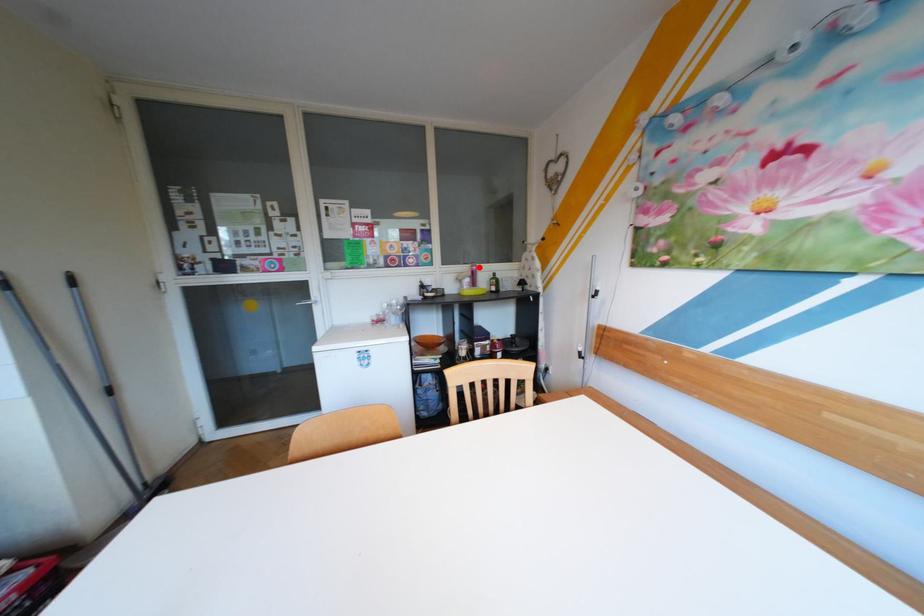
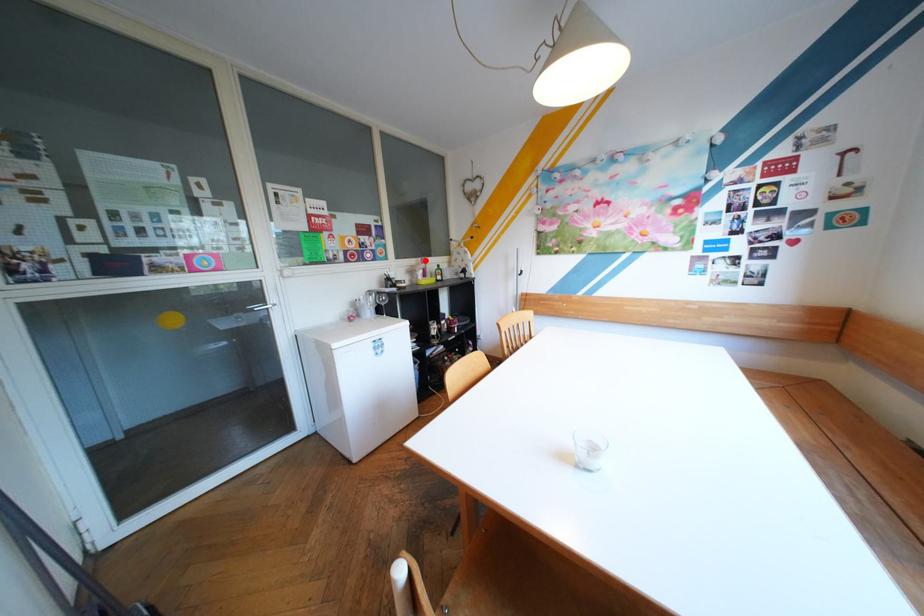
I am providing you with two images of the same scene from different viewpoints. A red point is marked on the first image and another point is marked on the second image. Does the point marked in image1 correspond to the same location as the one in image2?

Yes